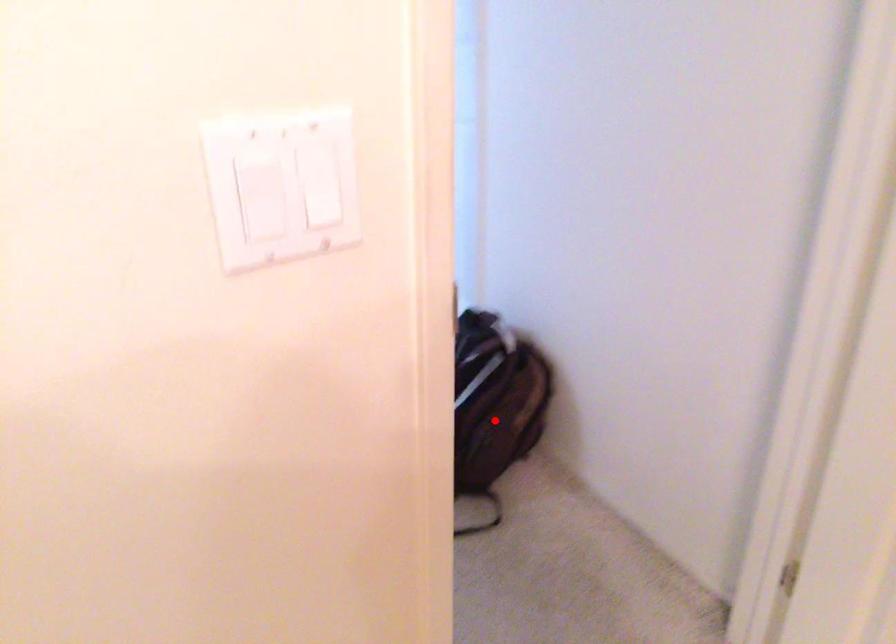
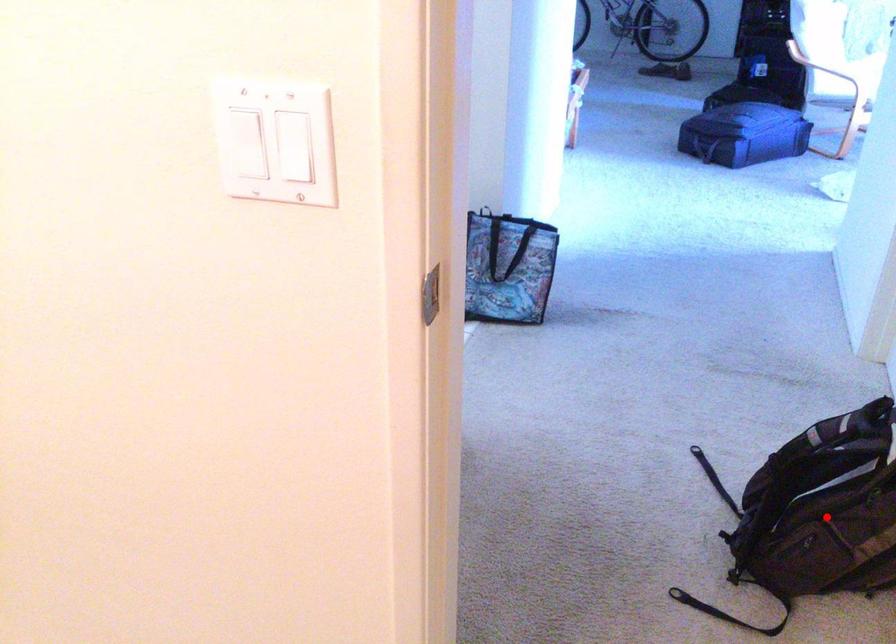
Consider the image. I am providing you with two images of the same scene from different viewpoints. A red point is marked on the first image and another point is marked on the second image. Are the points marked in image1 and image2 representing the same 3D position?

Yes